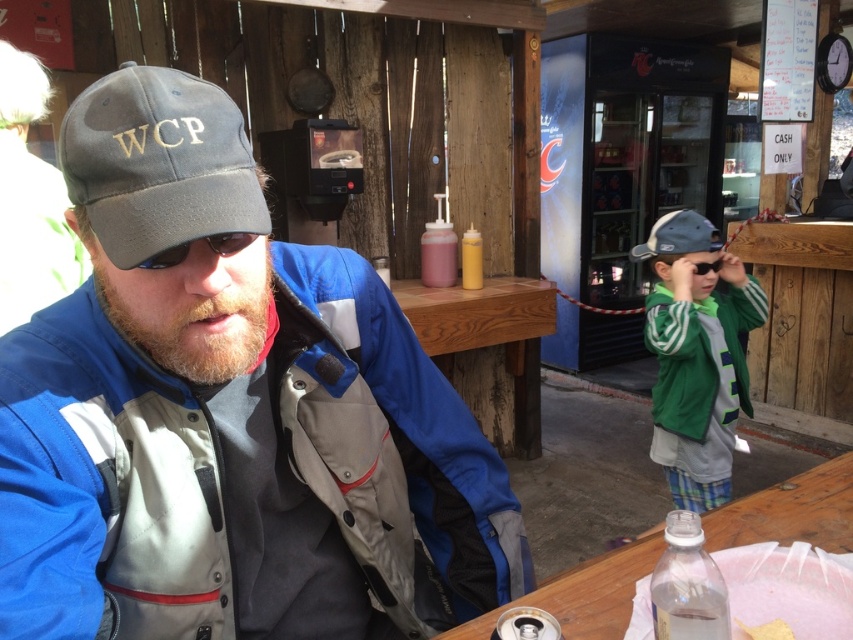
You are a waiter at the outdoor cafe. You need to deliver a drink to the customer seated at the wooden table at lower right. The clear plastic bottle at lower right is blocking your path. Can you easily reach the table without moving the bottle?

The clear plastic bottle at lower right is behind the wooden table at lower right, so it is not blocking the path to the table. You can easily reach the table without moving the bottle.

You are a delivery robot at the outdoor setting. You need to place a package on the table where the clear plastic bottle at lower right is located. What are the coordinates where you should place the package?

The clear plastic bottle at lower right is located at coordinates point [688,584], so you should place the package near that point.

You are a photographer trying to capture a candid shot of the man at the wooden table at lower right without the gray fabric baseball cap at upper left blocking the view. Is the cap currently in a position that would obstruct your shot?

The gray fabric baseball cap at upper left is in front of the wooden table at lower right, so it would obstruct the view of the man at the wooden table at lower right.